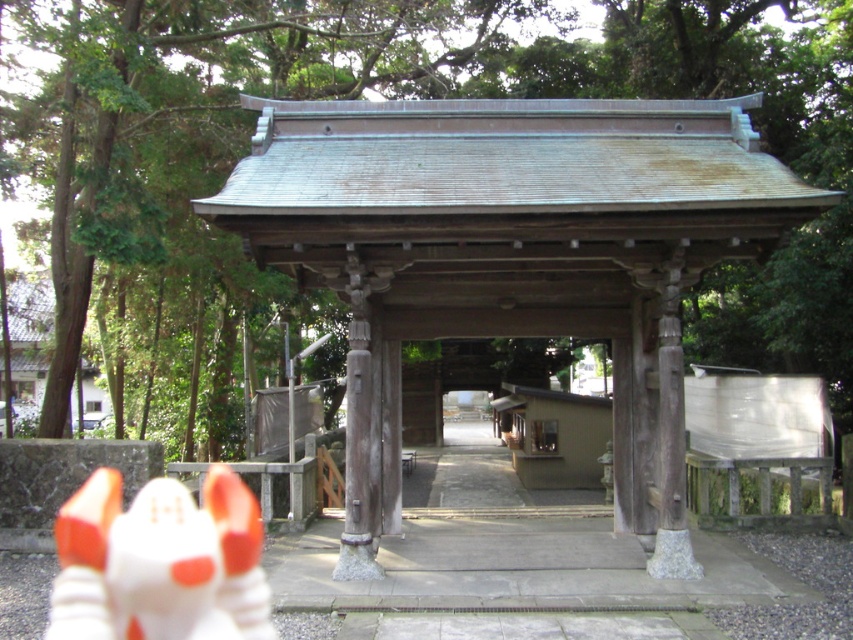
You are a visitor at the temple and see the wooden gazebo at center and the white matte toy at lower left. Which object is closer to you?

The wooden gazebo at center is closer to you because the white matte toy at lower left is behind it.